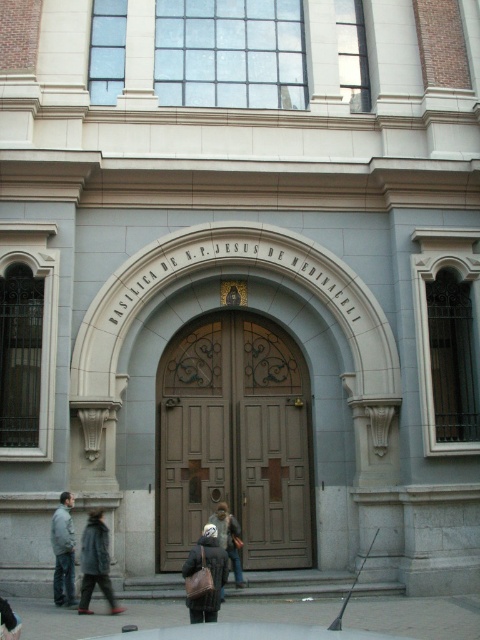
You are visiting the Basilica de N.P. Jesus de Medinaceli and see the brown wooden door at center and the dark brown leather coat at center. Which object is closer to you?

The brown wooden door at center is closer to you because the dark brown leather coat at center is behind it.

In the scene shown: You are a visitor standing at the entrance of the basilica. You notice two items at the lower left corner of the entrance area. Which one is shorter in height between the dark gray wool coat at lower left and the gray fabric jacket at lower left?

The dark gray wool coat at lower left is shorter in height than the gray fabric jacket at lower left.

You are a visitor at the basilica entrance and see the dark gray wool coat at lower left and the dark brown leather jacket at center. Which item is placed higher up?

The dark gray wool coat at lower left is located above the dark brown leather jacket at center, so it is placed higher up.